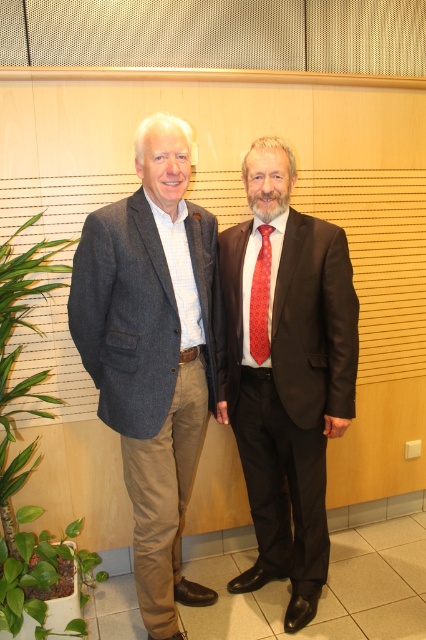
Between matte gray blazer at center and red silk tie at center, which one has more height?

With more height is matte gray blazer at center.

Who is more forward, (x=345, y=340) or (x=259, y=292)?

Point (x=259, y=292) is in front.

Identify the location of matte gray blazer at center. (230, 380).

Is gray woolen blazer at left to the right of green leafy plant at lower left from the viewer's perspective?

Correct, you'll find gray woolen blazer at left to the right of green leafy plant at lower left.

Does gray woolen blazer at left have a lesser height compared to green leafy plant at lower left?

In fact, gray woolen blazer at left may be taller than green leafy plant at lower left.

Where is `gray woolen blazer at left`? Image resolution: width=426 pixels, height=640 pixels. gray woolen blazer at left is located at coordinates (149, 372).

Is dark brown suit at center bigger than red silk tie at center?

Correct, dark brown suit at center is larger in size than red silk tie at center.

Between dark brown suit at center and red silk tie at center, which one appears on the right side from the viewer's perspective?

dark brown suit at center

Which is in front, point (308, 618) or point (270, 252)?

Positioned in front is point (270, 252).

This screenshot has width=426, height=640. I want to click on dark brown suit at center, so click(x=287, y=371).